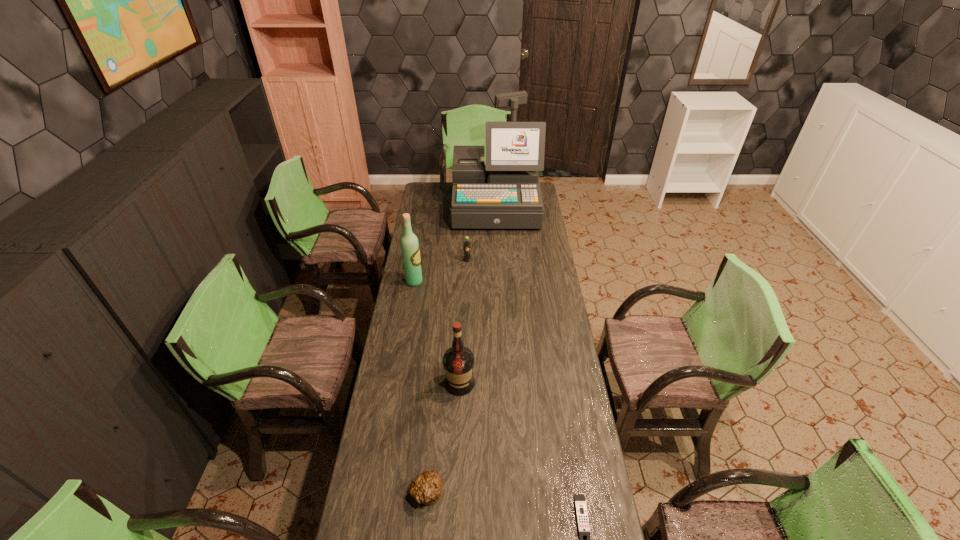
Locate an element on the screen. The image size is (960, 540). free space in the image that satisfies the following two spatial constraints: 1. on the front label of the third shortest object; 2. on the front-facing side of the wine bottle is located at coordinates (467, 282).

At what (x,y) coordinates should I click in order to perform the action: click on vacant region that satisfies the following two spatial constraints: 1. on the front-facing side of the third farthest object; 2. on the back side of the muffin. Please return your answer as a coordinate pair (x, y). Looking at the image, I should click on (378, 493).